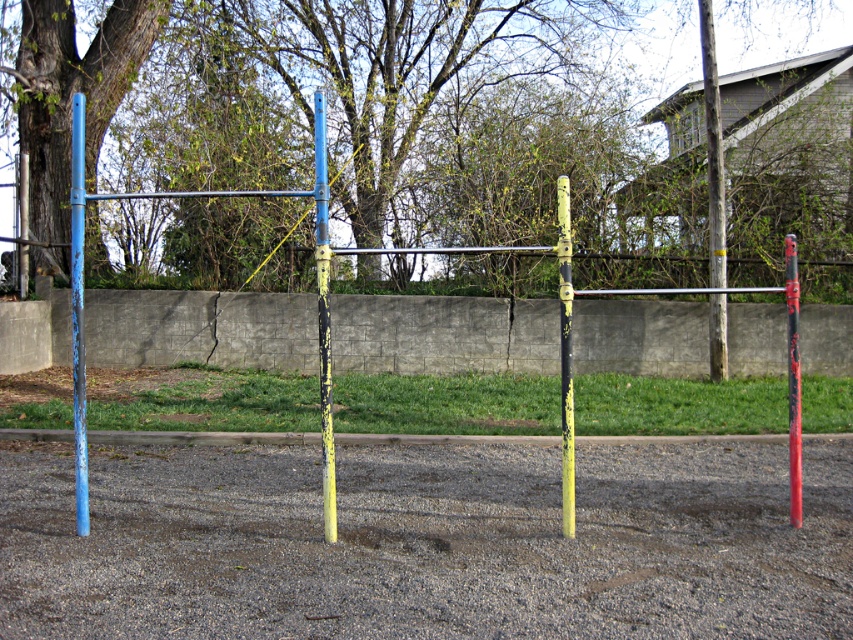
You are a maintenance worker inspecting the monkey bars. You notice the yellow painted pole at center and the red glossy pole at center. Which pole requires more material to replace if they need to be replaced with identical ones?

The red glossy pole at center requires more material to replace since it is larger than the yellow painted pole at center.

You are a child trying to climb the monkey bars. You notice the blue painted metal pole at left and the yellow painted pole at center. Which pole would you grab first if you want to start from the closest one to you?

The blue painted metal pole at left is in front of the yellow painted pole at center, so you should grab the blue painted metal pole at left first as it is closer to you.

You are a maintenance worker inspecting the monkey bars. You notice the blue painted metal pole at left and the yellow painted pole at center. Which pole requires more material to replace due to its size?

The blue painted metal pole at left requires more material to replace because it has a larger size compared to the yellow painted pole at center.